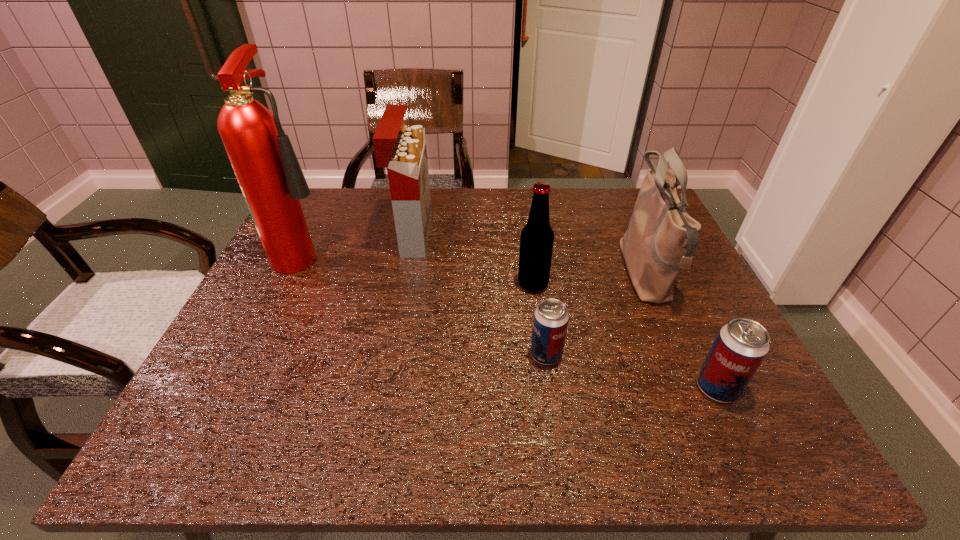
Image resolution: width=960 pixels, height=540 pixels. Find the location of `beer can present at the right edge`. beer can present at the right edge is located at coordinates (741, 345).

Find the location of a particular element. shoulder bag that is positioned at the right edge is located at coordinates 661,238.

What are the coordinates of `object that is at the near right corner` in the screenshot? It's located at (741, 345).

In the image, there is a desktop. Where is `vacant area at the far edge`? This screenshot has width=960, height=540. vacant area at the far edge is located at coordinates (569, 211).

Identify the location of free space at the near edge of the desktop. The width and height of the screenshot is (960, 540). (299, 404).

Where is `free space at the left edge`? This screenshot has height=540, width=960. free space at the left edge is located at coordinates (281, 307).

You are a GUI agent. You are given a task and a screenshot of the screen. Output one action in this format:
    pyautogui.click(x=<x>, y=<y>)
    Task: Click on the free location at the right edge
    Image resolution: width=960 pixels, height=540 pixels.
    Given the screenshot: What is the action you would take?
    pyautogui.click(x=701, y=343)

Locate an element on the screen. blank space at the far left corner of the desktop is located at coordinates (325, 228).

This screenshot has height=540, width=960. I want to click on blank space at the far right corner of the desktop, so click(620, 218).

Where is `free spot at the near right corner of the desktop`? This screenshot has height=540, width=960. free spot at the near right corner of the desktop is located at coordinates (680, 387).